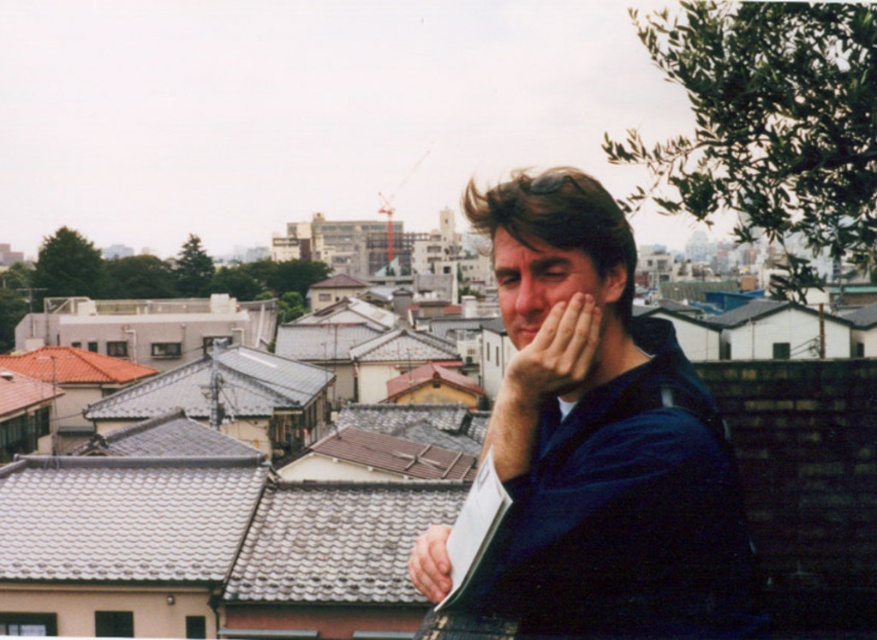
Based on the photo, is matte skin hand at center to the left of smooth skin hand at center from the viewer's perspective?

Incorrect, matte skin hand at center is not on the left side of smooth skin hand at center.

Is matte skin hand at center wider than smooth skin hand at center?

In fact, matte skin hand at center might be narrower than smooth skin hand at center.

Find the location of a particular element. The width and height of the screenshot is (877, 640). matte skin hand at center is located at coordinates (x=554, y=353).

Can you confirm if smooth skin face at center is taller than smooth skin hand at center?

In fact, smooth skin face at center may be shorter than smooth skin hand at center.

Which is in front, point (596, 326) or point (441, 554)?

Positioned in front is point (596, 326).

Identify the location of smooth skin face at center. (547, 294).

The width and height of the screenshot is (877, 640). I want to click on smooth skin face at center, so click(x=547, y=294).

Between point (726, 624) and point (576, 305), which one is positioned behind?

The point (726, 624) is more distant.

The image size is (877, 640). I want to click on dark blue shirt at center, so click(x=597, y=442).